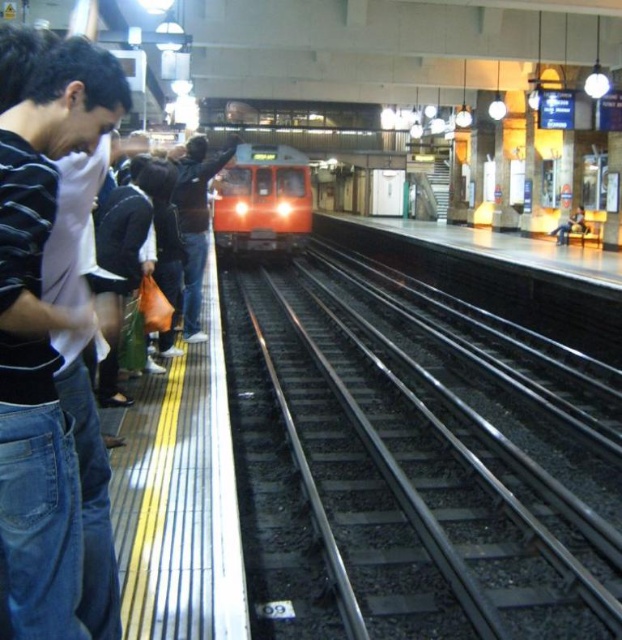
You are a passenger standing on the subway platform. You notice the black metal train track at center and the striped cotton shirt at left. Which object is closer to the edge of the platform?

The striped cotton shirt at left is closer to the edge of the platform because the black metal train track at center is located below it, meaning the shirt is positioned higher up near the edge.

You are a subway engineer inspecting the platform. You notice the black metal train track at center and the orange glossy train at center. Which object takes up more space in the image?

The black metal train track at center is larger in size than the orange glossy train at center, so it takes up more space in the image.